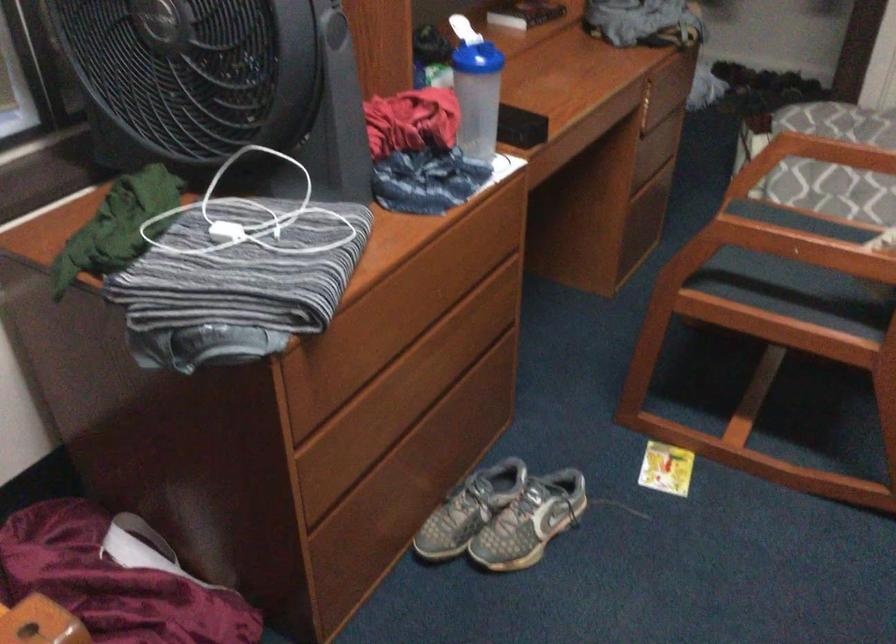
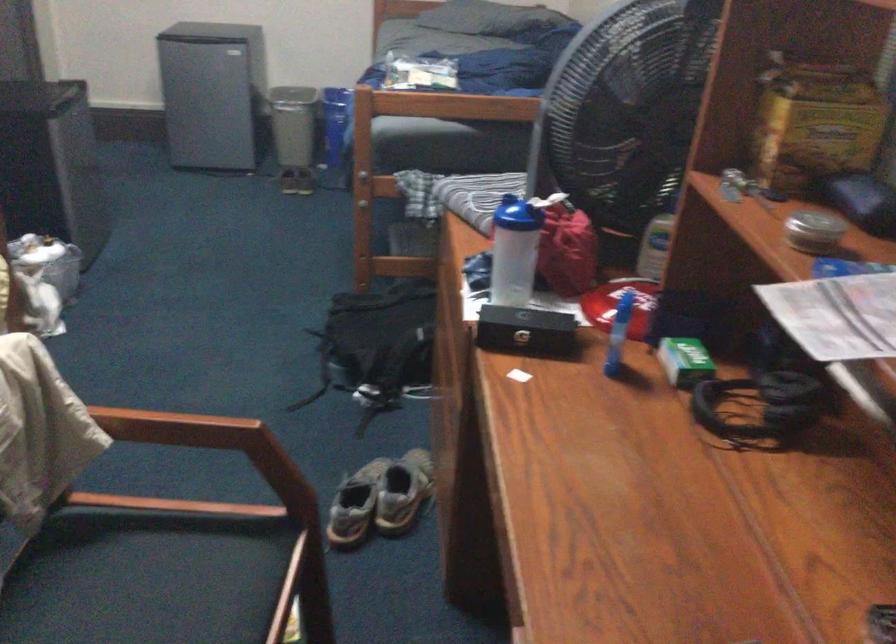
Question: I am providing you with two images of the same scene from different viewpoints. After the viewpoint changes to image2, which objects are now occluded?

Choices:
 (A) white power adapter
 (B) yellow cardboard box
 (C) green chopper handle
 (D) small green box

Answer: (A)